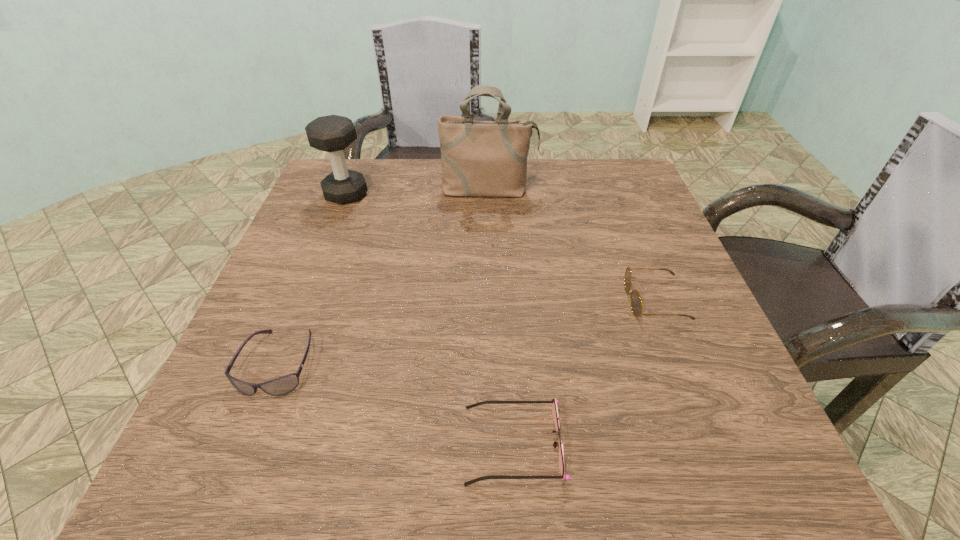
I want to click on dumbbell located at the left edge, so click(x=332, y=133).

This screenshot has height=540, width=960. What are the coordinates of `sunglasses that is at the left edge` in the screenshot? It's located at (283, 385).

At what (x,y) coordinates should I click in order to perform the action: click on object that is positioned at the right edge. Please return your answer as a coordinate pair (x, y). Looking at the image, I should click on (635, 301).

Locate an element on the screen. This screenshot has height=540, width=960. object that is at the far left corner is located at coordinates (332, 133).

This screenshot has width=960, height=540. I want to click on vacant space at the far edge, so click(x=484, y=206).

This screenshot has width=960, height=540. In the image, there is a desktop. In order to click on free region at the near edge in this screenshot , I will do `click(533, 475)`.

The image size is (960, 540). In the image, there is a desktop. Find the location of `free region at the left edge`. free region at the left edge is located at coordinates (230, 418).

Identify the location of vacant area at the right edge. (702, 406).

Find the location of a particular element. The image size is (960, 540). free location at the near left corner of the desktop is located at coordinates (220, 467).

In order to click on vacant space at the far right corner of the desktop in this screenshot , I will do `click(585, 165)`.